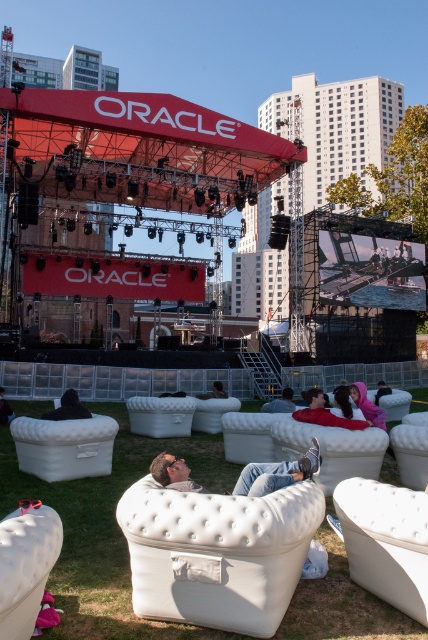
Between dark blue fabric jacket at lower center and dark gray fabric couch at center, which one is positioned lower?

dark blue fabric jacket at lower center is lower down.

Does dark blue fabric jacket at lower center have a lesser height compared to dark gray fabric couch at center?

In fact, dark blue fabric jacket at lower center may be taller than dark gray fabric couch at center.

Describe the element at coordinates (5, 408) in the screenshot. The width and height of the screenshot is (428, 640). I see `dark blue fabric jacket at lower center` at that location.

I want to click on dark blue fabric jacket at lower center, so click(x=5, y=408).

Between point (244, 470) and point (64, 408), which one is positioned behind?

Point (64, 408)

Can you confirm if light brown leather couch at center is wider than dark hair person at lower left?

Indeed, light brown leather couch at center has a greater width compared to dark hair person at lower left.

Which is in front, point (261, 461) or point (62, 396)?

Point (261, 461) is in front.

At what (x,y) coordinates should I click in order to perform the action: click on light brown leather couch at center. Please return your answer as a coordinate pair (x, y). This screenshot has height=640, width=428. Looking at the image, I should click on (276, 474).

Between green soft grass at lower center and dark hair person at lower left, which one has less height?

dark hair person at lower left

Between green soft grass at lower center and dark hair person at lower left, which one appears on the left side from the viewer's perspective?

dark hair person at lower left

Is point (175, 624) behind point (83, 406)?

No.

This screenshot has height=640, width=428. I want to click on green soft grass at lower center, so click(x=109, y=531).